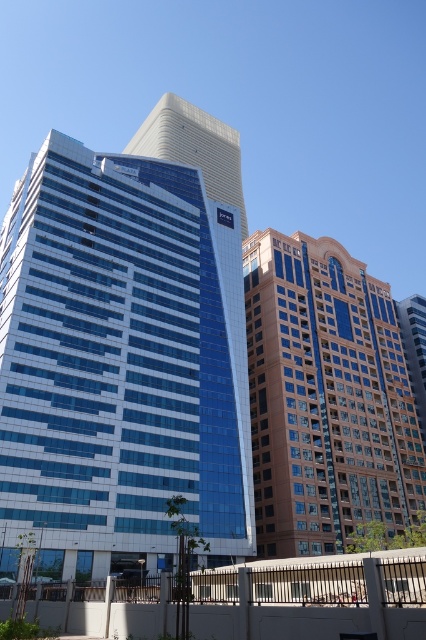
Can you confirm if blue glass building at center is smaller than white glass skyscraper at center?

Indeed, blue glass building at center has a smaller size compared to white glass skyscraper at center.

Identify the location of blue glass building at center. Image resolution: width=426 pixels, height=640 pixels. click(120, 364).

Can you confirm if blue glass building at center is shorter than brown brick building at center?

No, blue glass building at center is not shorter than brown brick building at center.

Can you confirm if blue glass building at center is bigger than brown brick building at center?

Yes, blue glass building at center is bigger than brown brick building at center.

Locate an element on the screen. Image resolution: width=426 pixels, height=640 pixels. blue glass building at center is located at coordinates (120, 364).

The image size is (426, 640). I want to click on blue glass building at center, so click(x=120, y=364).

Is brown brick building at center thinner than white glass skyscraper at center?

Yes.

Who is positioned more to the left, brown brick building at center or white glass skyscraper at center?

From the viewer's perspective, white glass skyscraper at center appears more on the left side.

Between point (409, 492) and point (173, 147), which one is positioned behind?

The point (173, 147) is more distant.

Find the location of `brown brick building at center`. brown brick building at center is located at coordinates (325, 397).